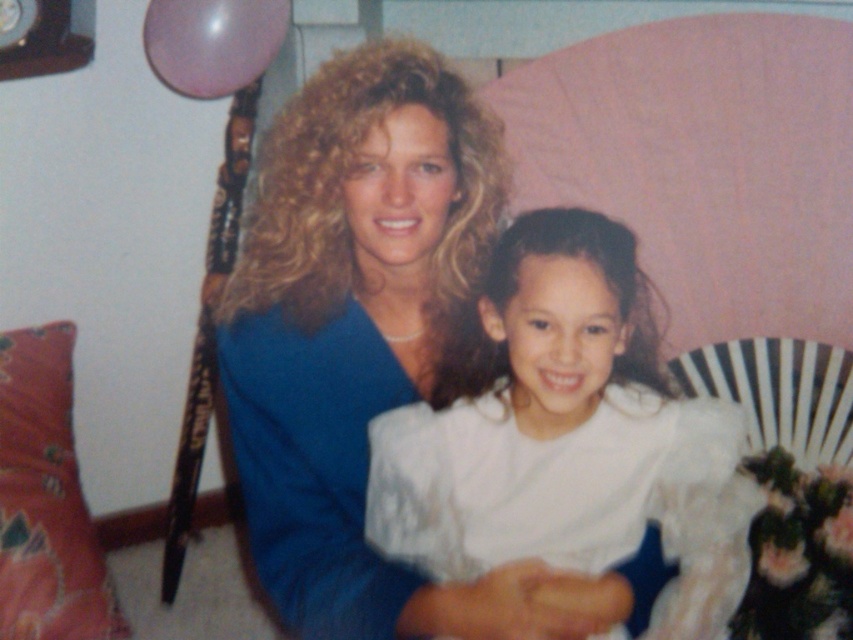
You are a photographer setting up for a family portrait. You see the blue satin dress at center and the floral fabric pillow at lower left in the scene. Which object is covering the other?

The blue satin dress at center is positioned over the floral fabric pillow at lower left, so it is covering the pillow.

You are a photographer setting up for a family photo shoot. You need to position a camera 1.2 meters away from the white satin dress at center so that it fits perfectly in the frame. Considering the floral fabric pillow at lower left is already placed 1.18 meters away from the dress, will the camera be closer to the dress than the pillow?

The white satin dress at center and floral fabric pillow at lower left are 1.18 meters apart. Since the camera needs to be 1.2 meters away from the dress, the camera would be slightly farther from the dress than the pillow, so the camera will not be closer to the dress than the pillow.